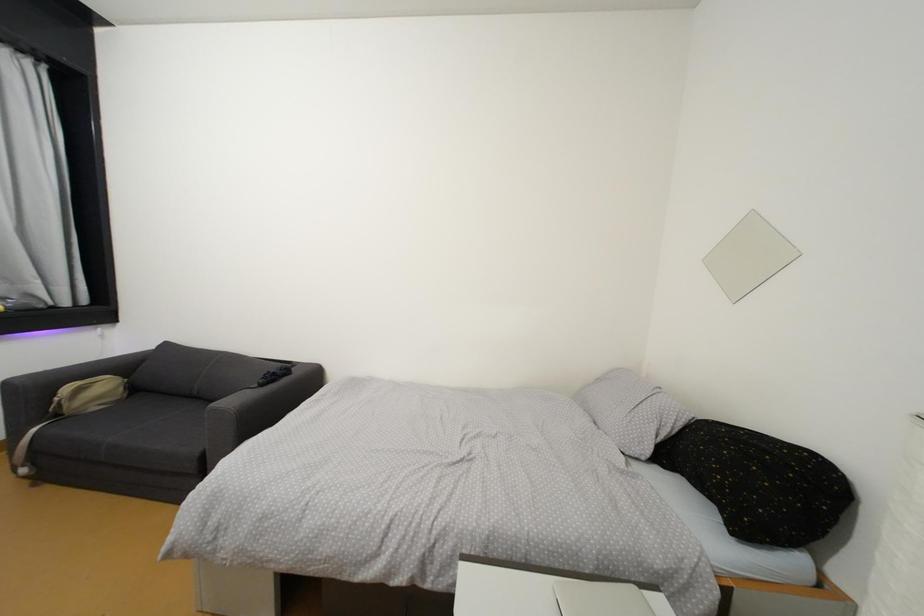
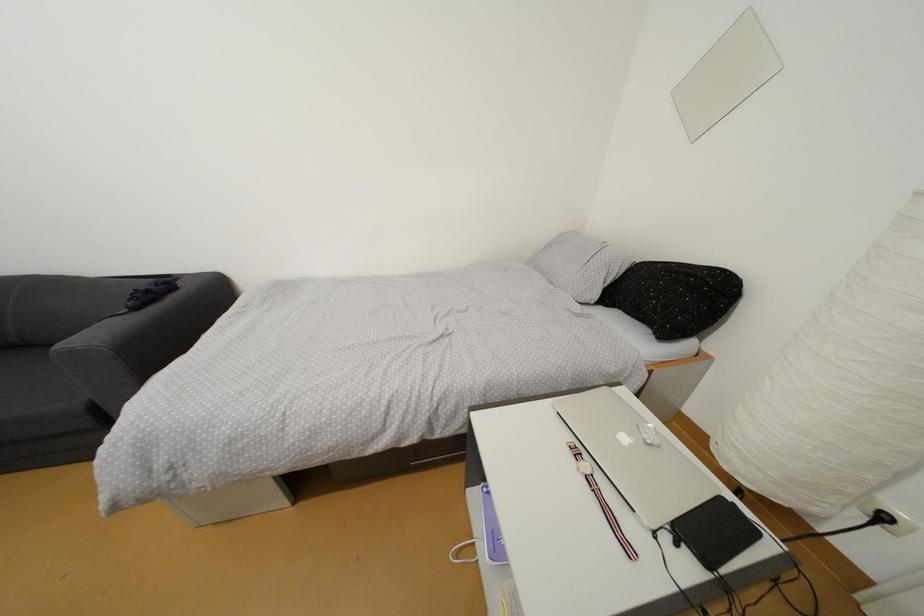
The images are taken continuously from a first-person perspective. In which direction is your viewpoint rotating?

The camera's rotation is toward right-down.